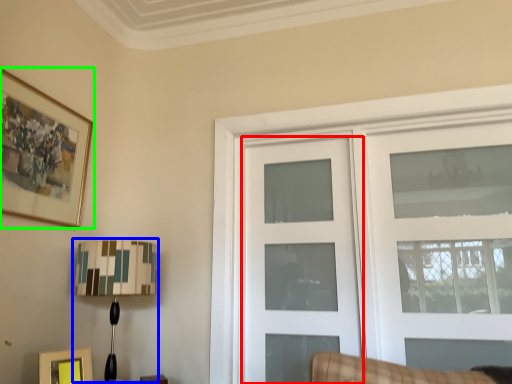
Question: Which is nearer to the door (highlighted by a red box)? table lamp (highlighted by a blue box) or picture frame (highlighted by a green box).

Choices:
 (A) table lamp
 (B) picture frame

Answer: (A)